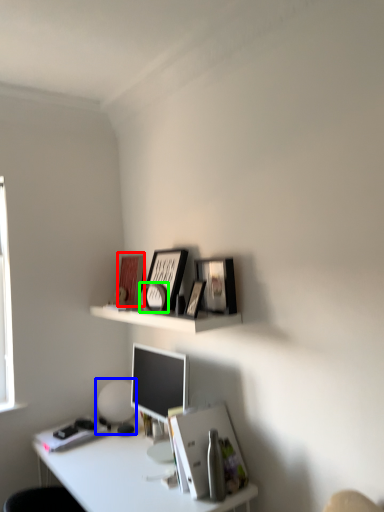
Question: Which is farther away from book cover (highlighted by a red box)? table lamp (highlighted by a blue box) or picture frame (highlighted by a green box)?

Choices:
 (A) table lamp
 (B) picture frame

Answer: (A)